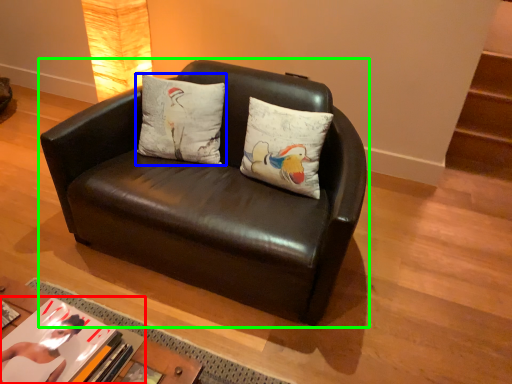
Question: Based on their relative distances, which object is nearer to book (highlighted by a red box)? Choose from pillow (highlighted by a blue box) and studio couch (highlighted by a green box).

Choices:
 (A) pillow
 (B) studio couch

Answer: (B)